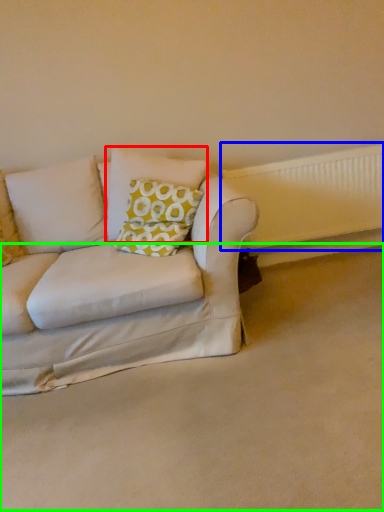
Question: Based on their relative distances, which object is farther from pillow (highlighted by a red box)? Choose from radiator (highlighted by a blue box) and plain (highlighted by a green box).

Choices:
 (A) radiator
 (B) plain

Answer: (B)